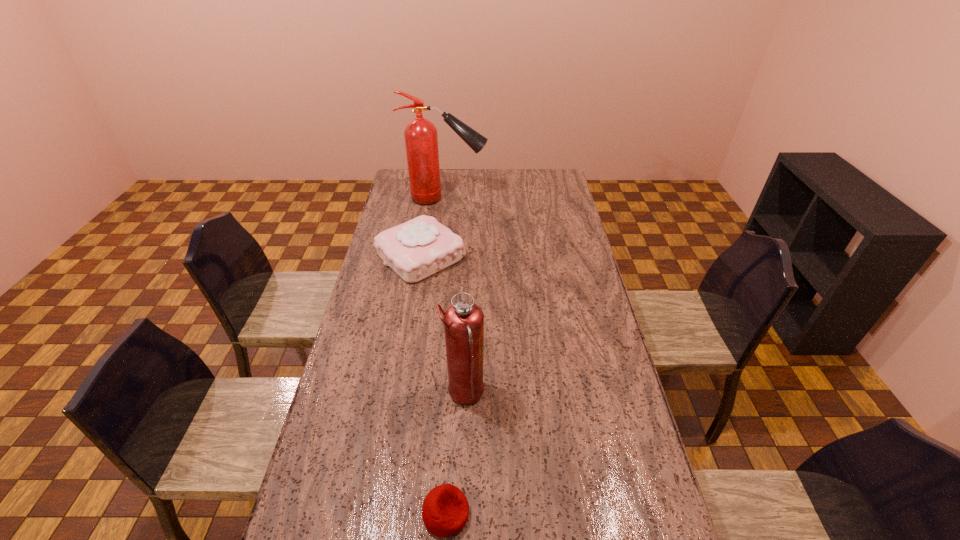
Find the location of a particular element. The width and height of the screenshot is (960, 540). vacant space that satisfies the following two spatial constraints: 1. at the nozzle end of the farthest object; 2. on the front side of the second farthest object is located at coordinates (439, 256).